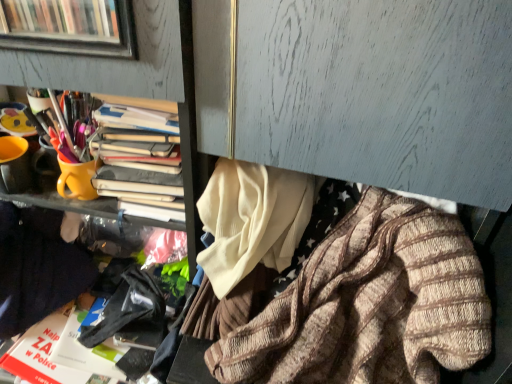
Where is `dark blue sweater at left, acting as the second clothing starting from the right`? The image size is (512, 384). dark blue sweater at left, acting as the second clothing starting from the right is located at coordinates (37, 267).

Identify the location of dark blue sweater at left, which ranks as the first clothing in left-to-right order. (37, 267).

From the image's perspective, between yellow matte cup at upper left and dark blue sweater at left, which ranks as the first clothing in left-to-right order, who is located below?

dark blue sweater at left, which ranks as the first clothing in left-to-right order, from the image's perspective.

Is yellow matte cup at upper left placed right next to dark blue sweater at left, acting as the second clothing starting from the right?

No, yellow matte cup at upper left is not touching dark blue sweater at left, acting as the second clothing starting from the right.

From a real-world perspective, is yellow matte cup at upper left positioned under dark blue sweater at left, acting as the second clothing starting from the right, based on gravity?

Incorrect, from a real-world perspective, yellow matte cup at upper left is higher than dark blue sweater at left, acting as the second clothing starting from the right.

From the picture: Measure the distance from yellow matte cup at upper left to dark blue sweater at left, acting as the second clothing starting from the right.

They are 8.86 inches apart.

From the image's perspective, count 2nd clothings downward from the yellow matte cup at upper left and point to it. Please provide its 2D coordinates.

[(369, 305)]

Considering the relative sizes of yellow matte cup at upper left and knitted wool sweater at lower right, which is counted as the 2th clothing, starting from the left, in the image provided, is yellow matte cup at upper left wider than knitted wool sweater at lower right, which is counted as the 2th clothing, starting from the left,?

No, yellow matte cup at upper left is not wider than knitted wool sweater at lower right, which is counted as the 2th clothing, starting from the left.

From the image's perspective, who appears lower, yellow matte cup at upper left or knitted wool sweater at lower right, placed as the first clothing when sorted from right to left?

knitted wool sweater at lower right, placed as the first clothing when sorted from right to left, is shown below in the image.

Looking at this image, can you confirm if dark blue sweater at left, which ranks as the first clothing in left-to-right order, is positioned to the left of yellow matte cup at upper left?

Correct, you'll find dark blue sweater at left, which ranks as the first clothing in left-to-right order, to the left of yellow matte cup at upper left.

Which of these two, dark blue sweater at left, which ranks as the first clothing in left-to-right order, or yellow matte cup at upper left, is smaller?

yellow matte cup at upper left is smaller.

Which of these two, dark blue sweater at left, which ranks as the first clothing in left-to-right order, or yellow matte cup at upper left, is wider?

Wider between the two is dark blue sweater at left, which ranks as the first clothing in left-to-right order.

Which of these two, dark blue sweater at left, acting as the second clothing starting from the right, or yellow matte cup at upper left, stands shorter?

With less height is yellow matte cup at upper left.

Considering the relative sizes of knitted wool sweater at lower right, placed as the first clothing when sorted from right to left, and yellow matte cup at upper left in the image provided, is knitted wool sweater at lower right, placed as the first clothing when sorted from right to left, smaller than yellow matte cup at upper left?

Incorrect, knitted wool sweater at lower right, placed as the first clothing when sorted from right to left, is not smaller in size than yellow matte cup at upper left.

Which is more distant, (368, 238) or (142, 105)?

The point (142, 105) is more distant.

The image size is (512, 384). There is a yellow matte cup at upper left. What are the coordinates of `the 1st clothing below it (from a real-world perspective)` in the screenshot? It's located at (369, 305).

Find the location of `clothing below the knitted wool sweater at lower right, which is counted as the 2th clothing, starting from the left (from a real-world perspective)`. clothing below the knitted wool sweater at lower right, which is counted as the 2th clothing, starting from the left (from a real-world perspective) is located at coordinates (37, 267).

From a real-world perspective, who is located lower, knitted wool sweater at lower right, which is counted as the 2th clothing, starting from the left, or dark blue sweater at left, acting as the second clothing starting from the right?

In real-world perspective, dark blue sweater at left, acting as the second clothing starting from the right, is lower.

In the scene shown: Is knitted wool sweater at lower right, which is counted as the 2th clothing, starting from the left, touching dark blue sweater at left, which ranks as the first clothing in left-to-right order?

No, knitted wool sweater at lower right, which is counted as the 2th clothing, starting from the left, is not touching dark blue sweater at left, which ranks as the first clothing in left-to-right order.

From the image's perspective, which one is positioned higher, knitted wool sweater at lower right, placed as the first clothing when sorted from right to left, or dark blue sweater at left, acting as the second clothing starting from the right?

dark blue sweater at left, acting as the second clothing starting from the right, appears higher in the image.

Is dark blue sweater at left, acting as the second clothing starting from the right, shorter than knitted wool sweater at lower right, placed as the first clothing when sorted from right to left?

Yes.

In the scene shown: Which point is more distant from viewer, [20,221] or [315,301]?

Point [20,221]

From the image's perspective, is dark blue sweater at left, acting as the second clothing starting from the right, above knitted wool sweater at lower right, placed as the first clothing when sorted from right to left?

Indeed, from the image's perspective, dark blue sweater at left, acting as the second clothing starting from the right, is shown above knitted wool sweater at lower right, placed as the first clothing when sorted from right to left.

What are the coordinates of `bookcase behind the dark blue sweater at left, acting as the second clothing starting from the right` in the screenshot? It's located at [x=140, y=103].

From the image's perspective, which clothing is the 2nd one below the yellow matte cup at upper left? Please provide its 2D coordinates.

[(369, 305)]

Looking at this image, based on their spatial positions, is knitted wool sweater at lower right, placed as the first clothing when sorted from right to left, or dark blue sweater at left, which ranks as the first clothing in left-to-right order, closer to yellow matte cup at upper left?

dark blue sweater at left, which ranks as the first clothing in left-to-right order, lies closer to yellow matte cup at upper left than the other object.

Considering their positions, is yellow matte cup at upper left positioned closer to dark blue sweater at left, acting as the second clothing starting from the right, than knitted wool sweater at lower right, which is counted as the 2th clothing, starting from the left?

Among the two, yellow matte cup at upper left is located nearer to dark blue sweater at left, acting as the second clothing starting from the right.

Which object lies nearer to the anchor point yellow matte cup at upper left, dark blue sweater at left, acting as the second clothing starting from the right, or knitted wool sweater at lower right, which is counted as the 2th clothing, starting from the left?

The object closer to yellow matte cup at upper left is dark blue sweater at left, acting as the second clothing starting from the right.

Estimate the real-world distances between objects in this image. Which object is closer to knitted wool sweater at lower right, placed as the first clothing when sorted from right to left, dark blue sweater at left, which ranks as the first clothing in left-to-right order, or yellow matte cup at upper left?

yellow matte cup at upper left is closer to knitted wool sweater at lower right, placed as the first clothing when sorted from right to left.

Based on their spatial positions, is knitted wool sweater at lower right, which is counted as the 2th clothing, starting from the left, or yellow matte cup at upper left further from dark blue sweater at left, acting as the second clothing starting from the right?

Based on the image, knitted wool sweater at lower right, which is counted as the 2th clothing, starting from the left, appears to be further to dark blue sweater at left, acting as the second clothing starting from the right.

From the image, which object appears to be nearer to knitted wool sweater at lower right, which is counted as the 2th clothing, starting from the left, yellow matte cup at upper left or dark blue sweater at left, acting as the second clothing starting from the right?

yellow matte cup at upper left lies closer to knitted wool sweater at lower right, which is counted as the 2th clothing, starting from the left, than the other object.

Image resolution: width=512 pixels, height=384 pixels. I want to click on bookcase located between dark blue sweater at left, which ranks as the first clothing in left-to-right order, and knitted wool sweater at lower right, placed as the first clothing when sorted from right to left, in the left-right direction, so click(140, 103).